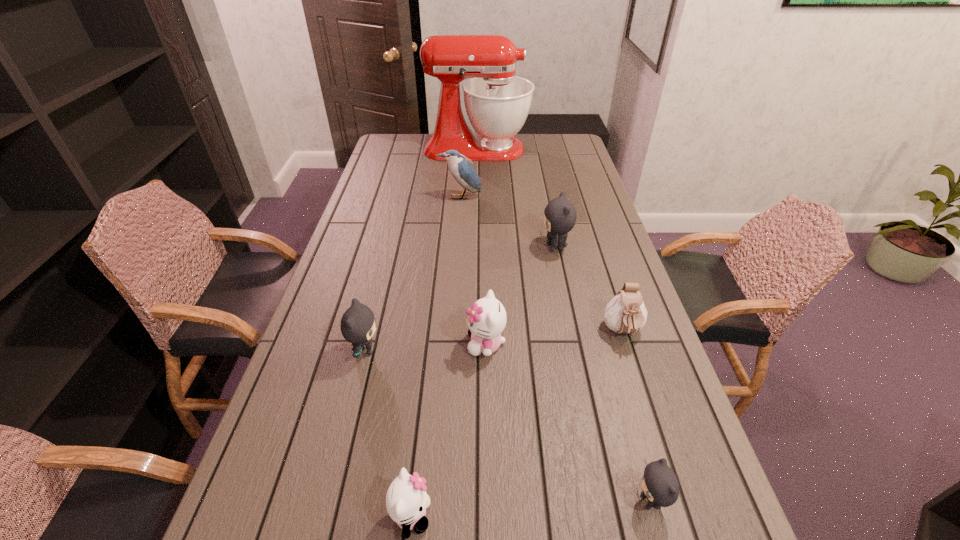
Image resolution: width=960 pixels, height=540 pixels. What are the coordinates of `pouch` in the screenshot? It's located at (626, 313).

You are a GUI agent. You are given a task and a screenshot of the screen. Output one action in this format:
    pyautogui.click(x=<x>, y=<y>)
    Task: Click on the smallest gray kitten
    Image resolution: width=960 pixels, height=540 pixels.
    Given the screenshot: What is the action you would take?
    pyautogui.click(x=660, y=486)

The height and width of the screenshot is (540, 960). I want to click on vacant space located 0.180m at the attachment hub of the tallest object, so click(x=568, y=149).

Where is `vacant space situated at the tip of the second farthest object's beak`? Image resolution: width=960 pixels, height=540 pixels. vacant space situated at the tip of the second farthest object's beak is located at coordinates (458, 222).

This screenshot has height=540, width=960. What are the coordinates of `free space located on the front-facing side of the biggest gray kitten` in the screenshot? It's located at (480, 247).

Image resolution: width=960 pixels, height=540 pixels. What are the coordinates of `vacant region located 0.060m on the front-facing side of the biggest gray kitten` in the screenshot? It's located at (522, 247).

The image size is (960, 540). Find the location of `vacant space located 0.190m on the front-facing side of the biggest gray kitten`. vacant space located 0.190m on the front-facing side of the biggest gray kitten is located at coordinates (483, 247).

This screenshot has width=960, height=540. I want to click on free spot located 0.070m on the front-facing side of the farther white kitten, so click(440, 344).

Where is `vacant space located 0.350m on the front-facing side of the farther white kitten`? vacant space located 0.350m on the front-facing side of the farther white kitten is located at coordinates (333, 344).

Locate an element on the screen. The width and height of the screenshot is (960, 540). vacant space located 0.190m on the front-facing side of the farther white kitten is located at coordinates (394, 344).